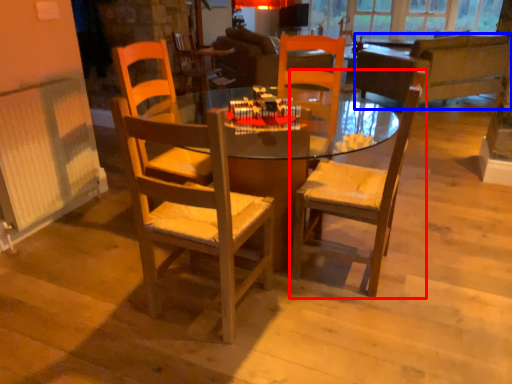
Question: Which object appears closest to the camera in this image, chair (highlighted by a red box) or studio couch (highlighted by a blue box)?

Choices:
 (A) chair
 (B) studio couch

Answer: (A)